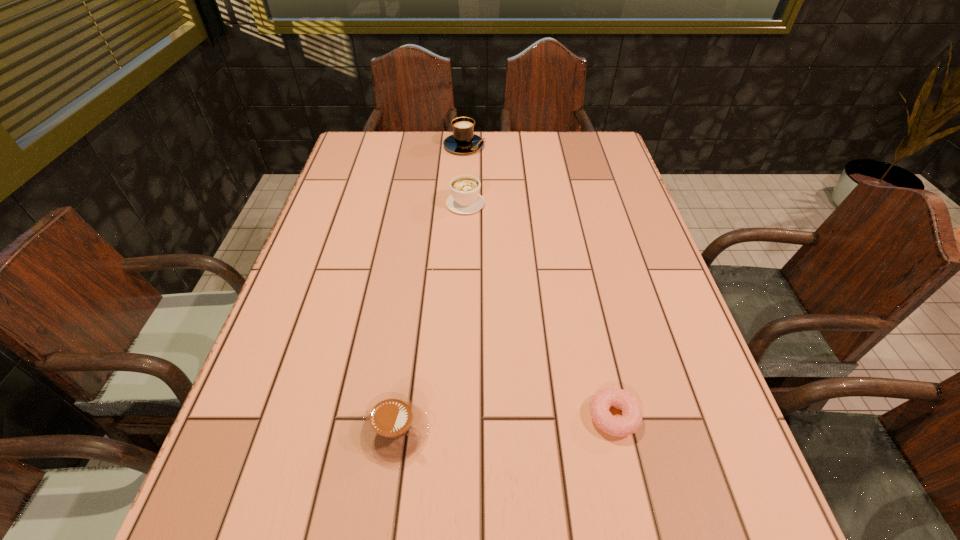
What are the coordinates of `vacant area situated on the right of the nearest cappuccino` in the screenshot? It's located at (531, 430).

Locate an element on the screen. This screenshot has height=540, width=960. vacant area located on the back of the rightmost object is located at coordinates (588, 301).

In order to click on object that is at the far edge in this screenshot , I will do `click(463, 140)`.

Identify the location of object located at the right edge. (630, 421).

I want to click on free space at the far edge of the desktop, so click(493, 148).

Locate an element on the screen. free spot at the left edge of the desktop is located at coordinates (286, 442).

Identify the location of vacant space at the right edge of the desktop. (708, 387).

Locate an element on the screen. vacant space at the far left corner of the desktop is located at coordinates pyautogui.click(x=363, y=157).

In the image, there is a desktop. Identify the location of vacant region at the far right corner. This screenshot has width=960, height=540. (576, 151).

This screenshot has width=960, height=540. I want to click on unoccupied area between the second farthest cappuccino and the tallest object, so click(x=465, y=174).